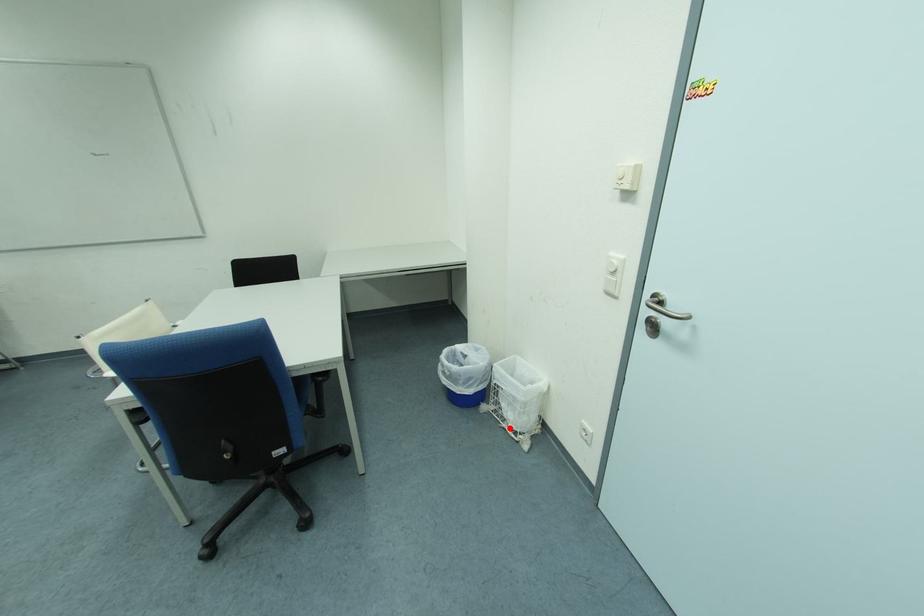
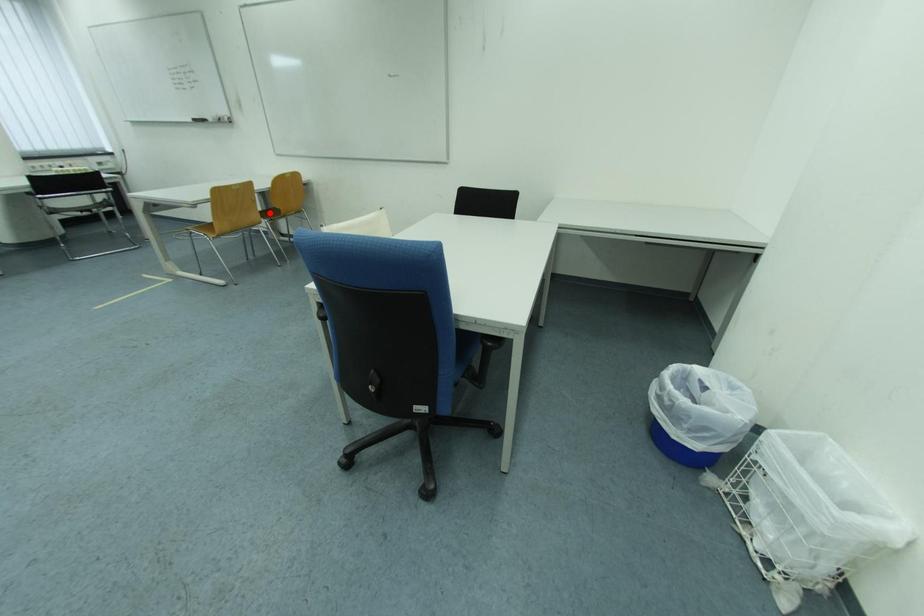
I am providing you with two images of the same scene from different viewpoints. A red point is marked on the first image and another point is marked on the second image. Is the red point in image1 aligned with the point shown in image2?

No